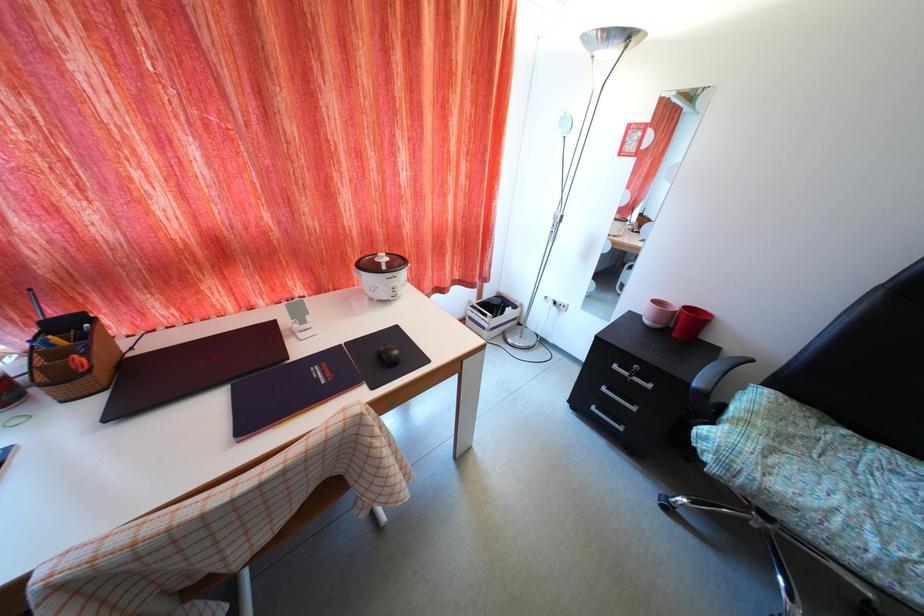
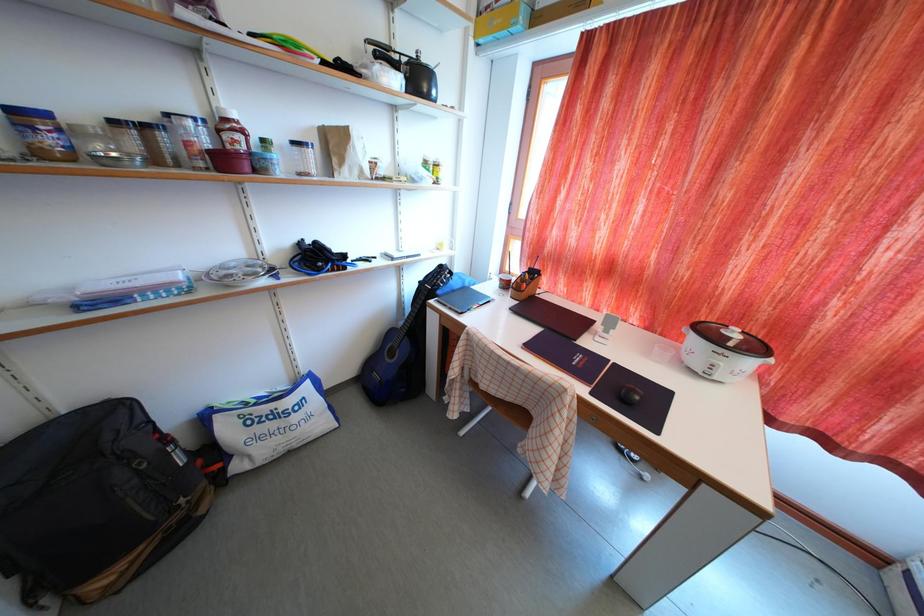
Based on the continuous images, in which direction is the camera rotating?

The camera rotated toward left-down.